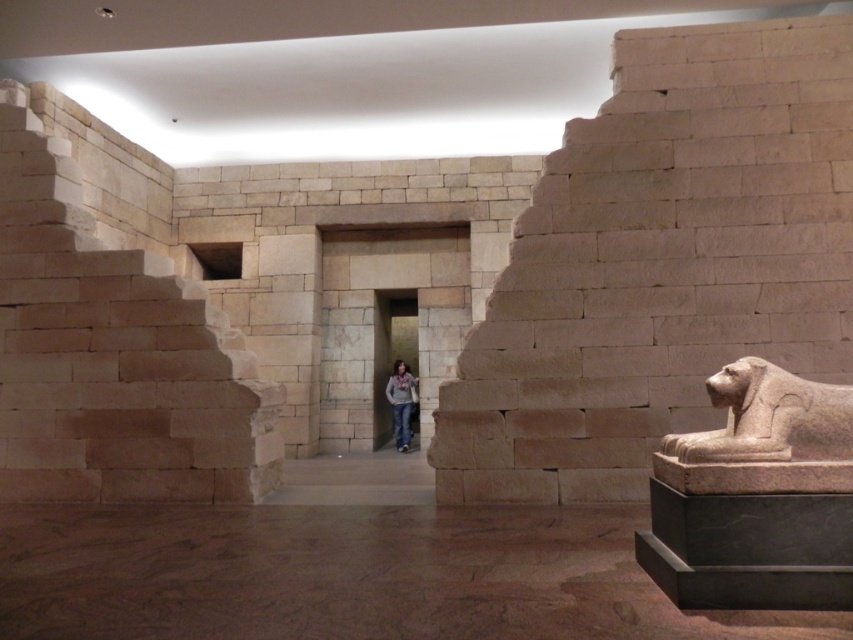
You are an interior designer planning to place a new sculpture in the museum exhibit. The exhibit has limited space, and you need to ensure the sculpture will fit between the smooth stone sphinx at right and the light brown leather jacket at center. Given that the sculpture is 1.2 meters wide, can you confirm if there is enough space between them?

The smooth stone sphinx at right is wider than the light brown leather jacket at center. Therefore, the space between them may vary depending on their exact placement. However, since the sculpture is only 1.2 meters wide, it should fit as long as the distance between the two objects is at least 1.2 meters. The exact width of the sphinx and jacket isn

You are a visitor in the museum and want to take a photo of both the smooth stone sphinx at right and the light brown leather jacket at center without moving either object. Is there enough space between them for you to capture both in a single photo frame?

The smooth stone sphinx at right and the light brown leather jacket at center are 6.92 meters apart from each other. Depending on the camera lens and distance from the objects, capturing both in a single frame may be possible, but the significant distance might require a wide angle or moving back further to include both.

You are an archaeologist exploring the museum exhibit and need to reach the back wall to examine an inscription. You see the beige stone stairs at center and the beige stone stairs at left. Which set of stairs should you take to get closer to the back wall?

You should take the beige stone stairs at left because the beige stone stairs at center is in front of it, meaning the stairs at left are further back and closer to the back wall.